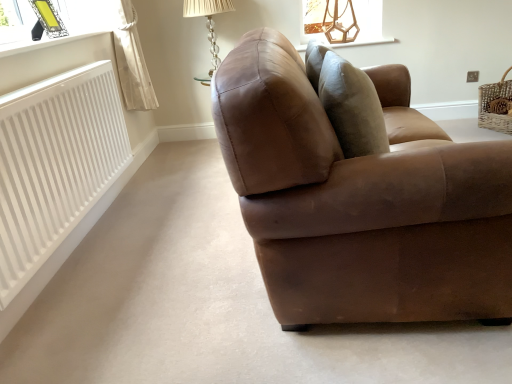
Question: Is translucent glass table lamp at upper center in front of or behind white smooth radiator at left in the image?

Choices:
 (A) front
 (B) behind

Answer: (B)

Question: Is translucent glass table lamp at upper center to the left or to the right of white smooth radiator at left in the image?

Choices:
 (A) left
 (B) right

Answer: (B)

Question: Estimate the real-world distances between objects in this image. Which object is farther from the translucent glass table lamp at upper center?

Choices:
 (A) white wicker basket at right
 (B) wooden at upper center
 (C) brown leather couch at center
 (D) white smooth radiator at left

Answer: (C)

Question: Which object is positioned farthest from the white smooth radiator at left?

Choices:
 (A) brown leather couch at center
 (B) wooden at upper center
 (C) translucent glass table lamp at upper center
 (D) white wicker basket at right

Answer: (D)